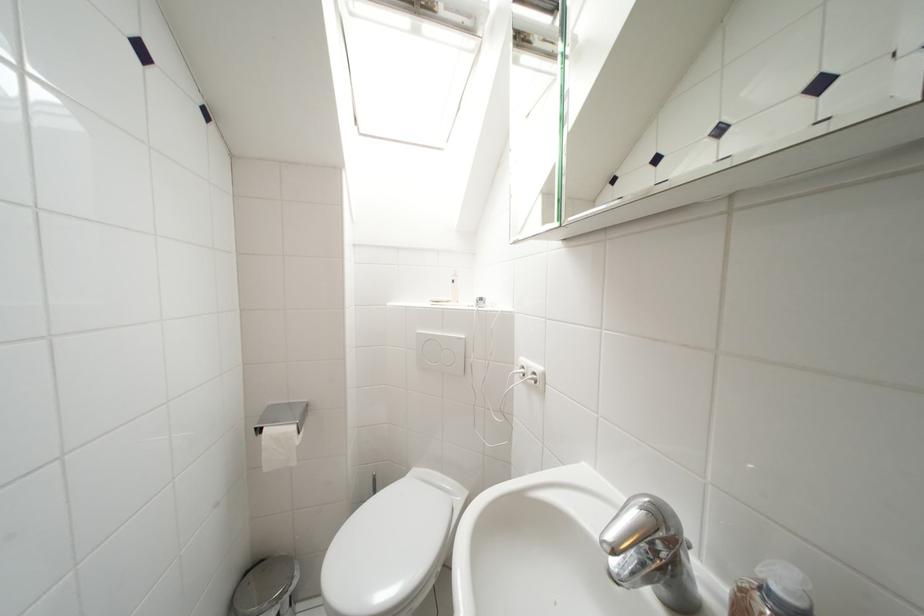
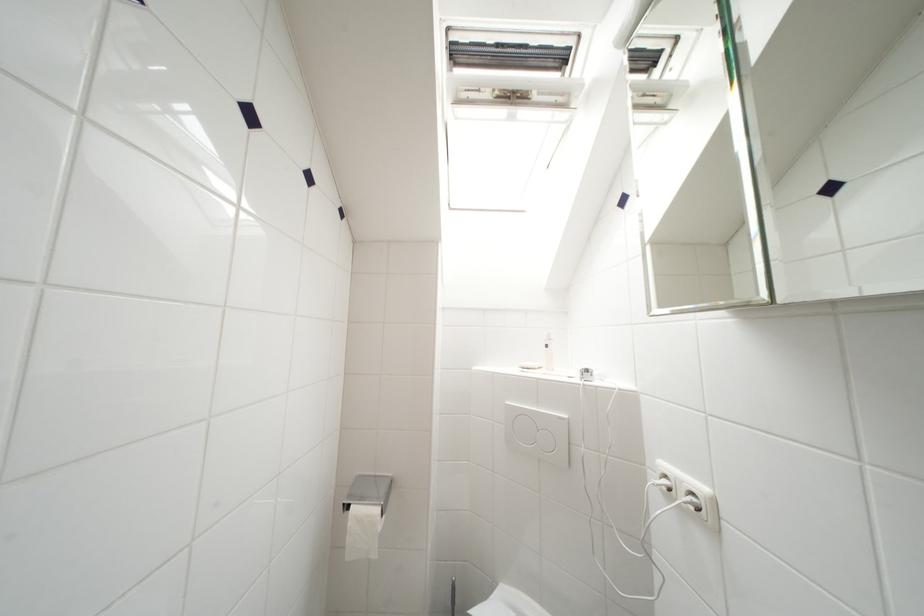
Find the pixel in the second image that matches pixel 266 435 in the first image.

(354, 512)